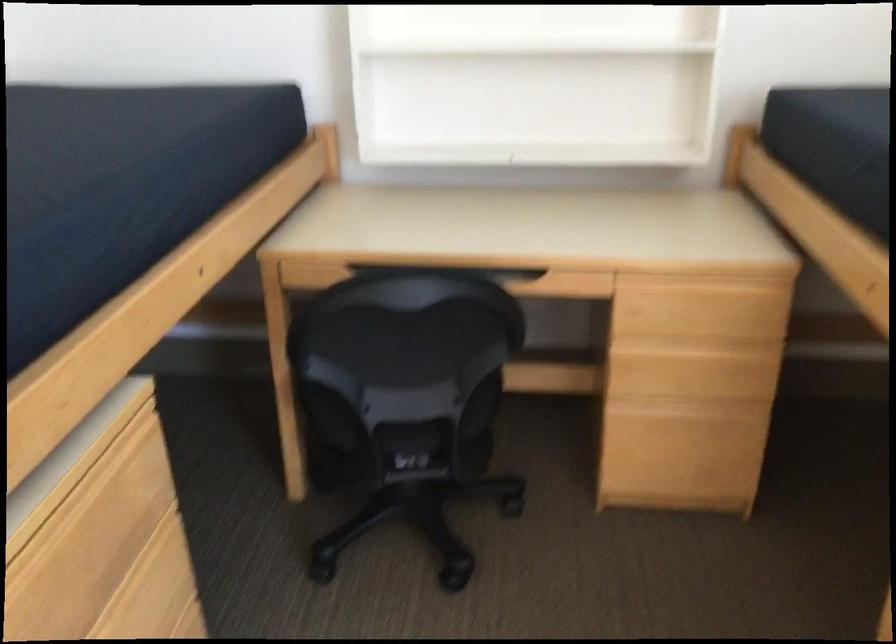
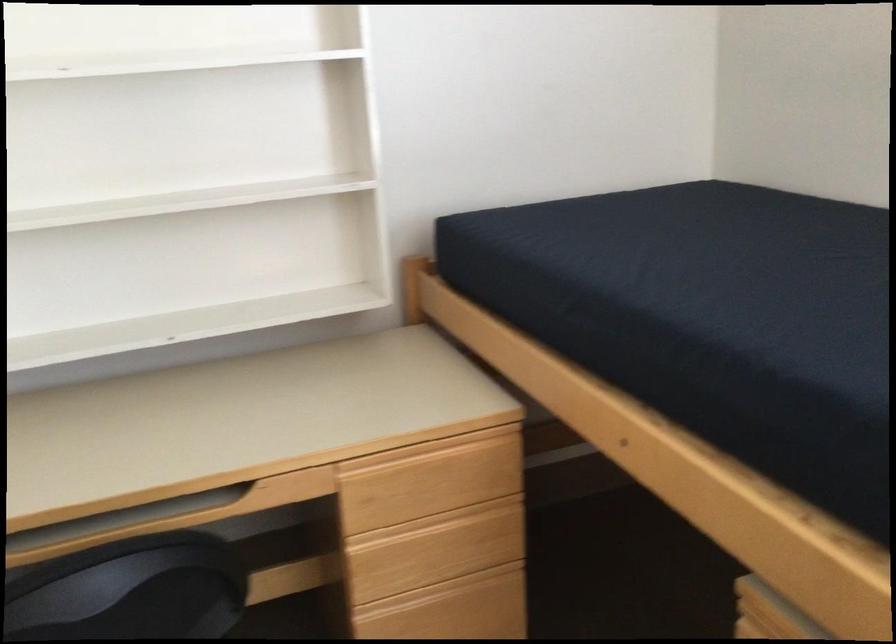
Where in the second image is the point corresponding to the point at 695,346 from the first image?

(443, 524)